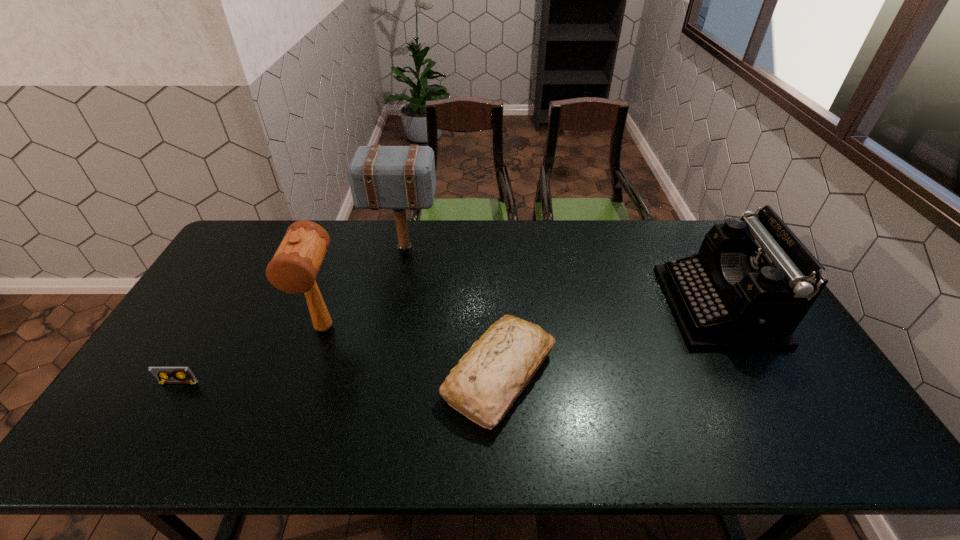
What are the coordinates of `vacant space situated 0.210m on the striking surface of the farthest object` in the screenshot? It's located at (499, 252).

Where is `free space located 0.090m on the strike surface of the second object from left to right`? free space located 0.090m on the strike surface of the second object from left to right is located at coordinates pyautogui.click(x=306, y=380).

Where is `vacant area situated on the typing side of the typewriter`? vacant area situated on the typing side of the typewriter is located at coordinates (643, 306).

The width and height of the screenshot is (960, 540). Identify the location of vacant area situated on the typing side of the typewriter. (578, 306).

Where is `vacant space located on the typing side of the typewriter`? The height and width of the screenshot is (540, 960). vacant space located on the typing side of the typewriter is located at coordinates pos(620,306).

Where is `vacant region located on the right of the second object from right to left`? The image size is (960, 540). vacant region located on the right of the second object from right to left is located at coordinates (644, 375).

Where is `vacant space situated 0.150m at the front of the leftmost object with visible reels`? vacant space situated 0.150m at the front of the leftmost object with visible reels is located at coordinates (145, 439).

The image size is (960, 540). In order to click on object that is at the far edge in this screenshot , I will do [381, 177].

This screenshot has width=960, height=540. Identify the location of object at the near edge. (487, 380).

The width and height of the screenshot is (960, 540). Find the location of `object located in the left edge section of the desktop`. object located in the left edge section of the desktop is located at coordinates (180, 374).